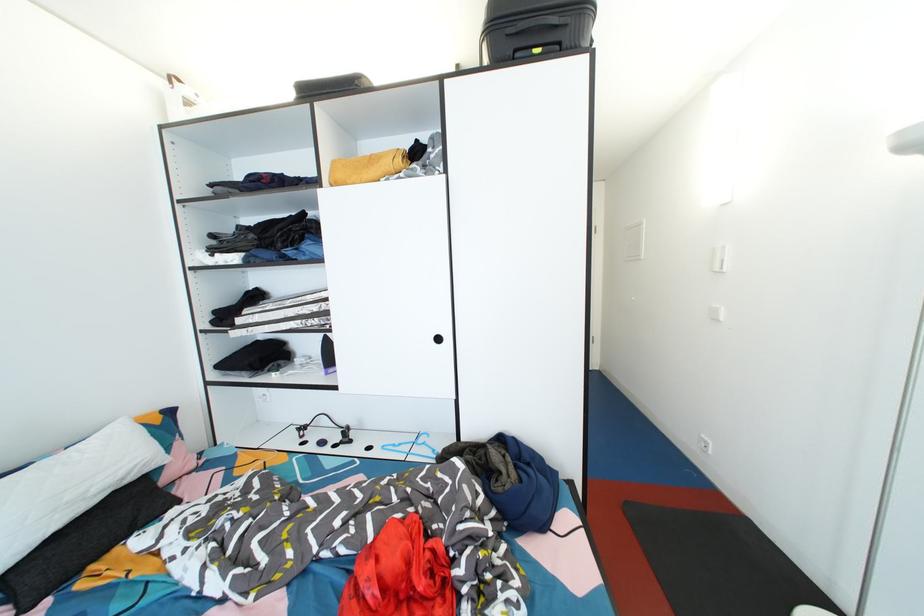
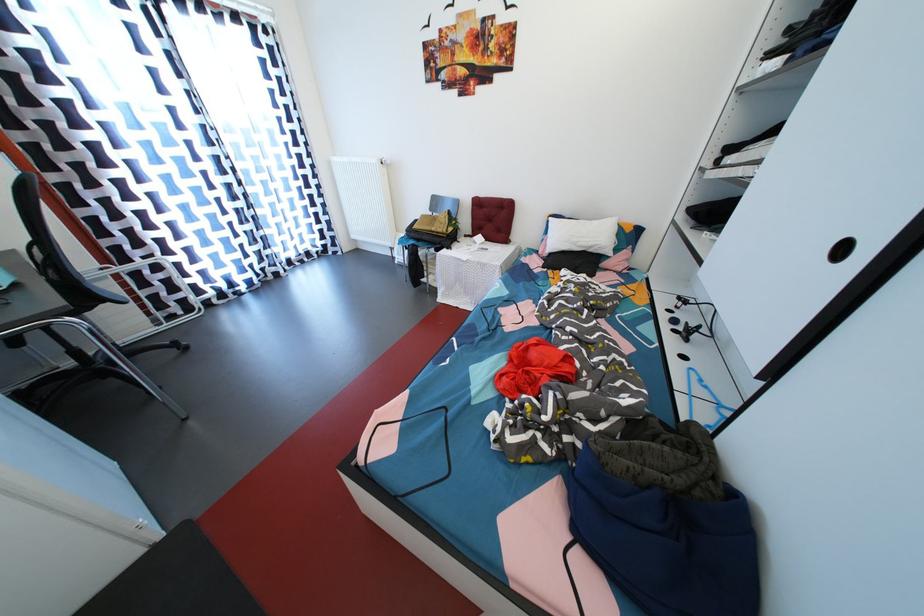
Where in the second image is the point corresponding to point 444,344 from the first image?

(848, 254)